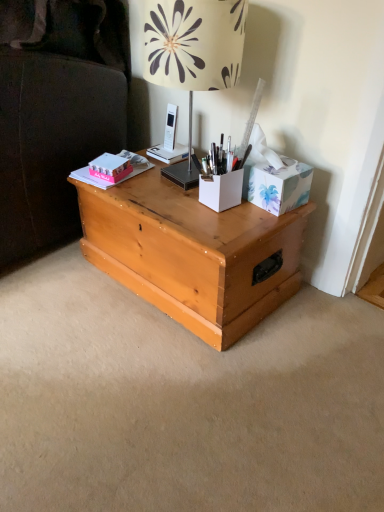
In order to click on vacant area situated to the left side of floral-patterned cardboard tissue box at upper right, marked as the second cardboard box in a left-to-right arrangement in this screenshot , I will do `click(217, 214)`.